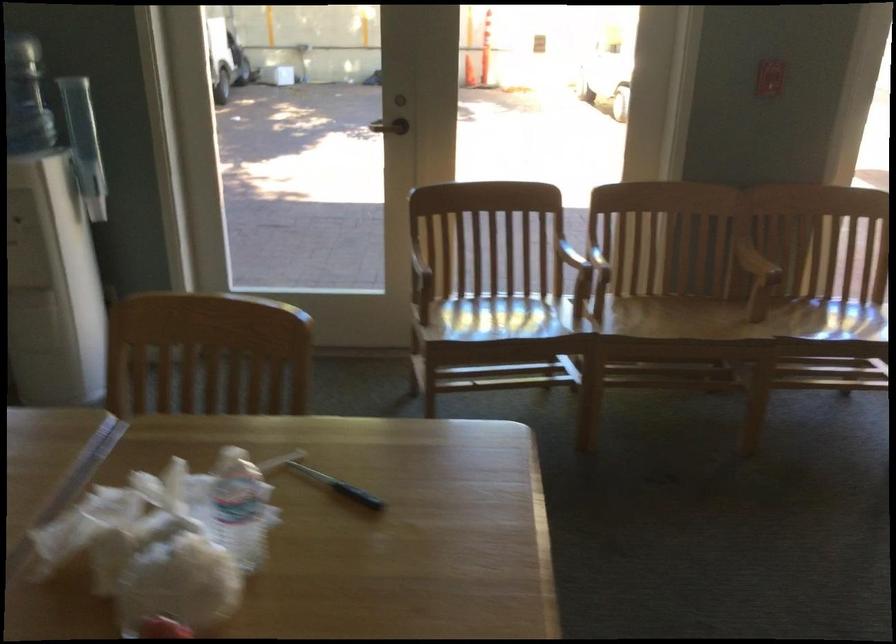
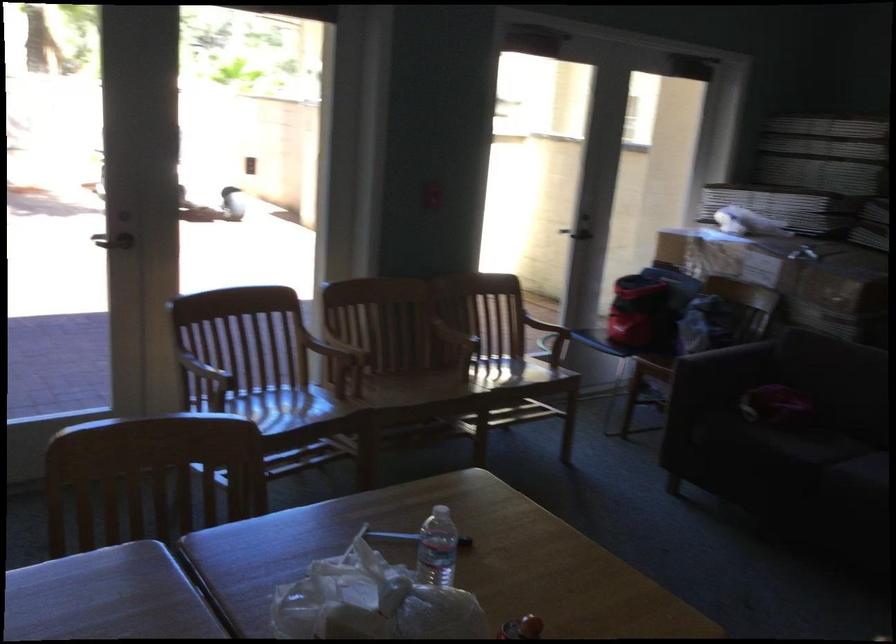
The point at (760,267) is marked in the first image. Where is the corresponding point in the second image?

(460, 339)